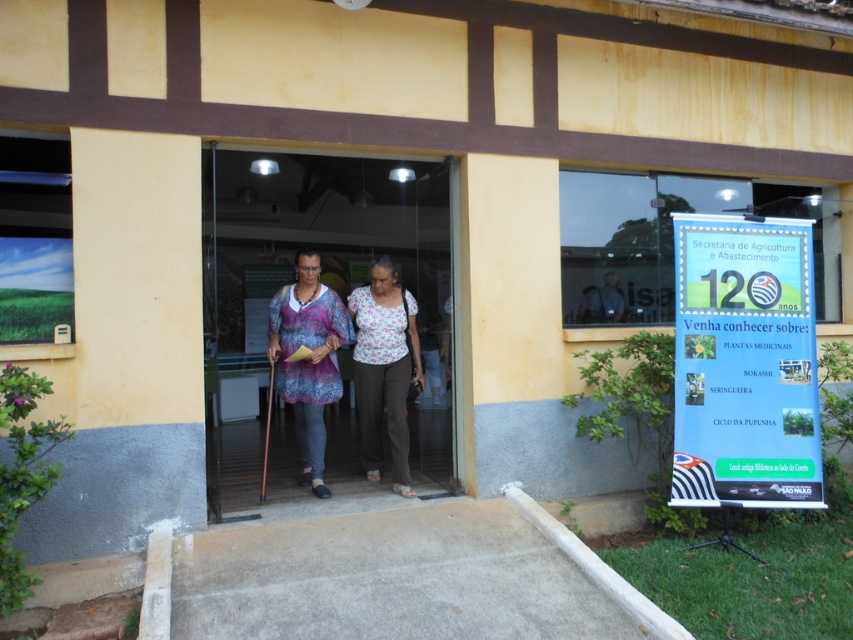
Between wooden door at center and floral fabric blouse at center, which one has more height?

With more height is floral fabric blouse at center.

Is wooden door at center taller than floral fabric blouse at center?

No, wooden door at center is not taller than floral fabric blouse at center.

The height and width of the screenshot is (640, 853). What do you see at coordinates (320, 280) in the screenshot? I see `wooden door at center` at bounding box center [320, 280].

You are a GUI agent. You are given a task and a screenshot of the screen. Output one action in this format:
    pyautogui.click(x=<x>, y=<y>)
    Task: Click on the wooden door at center
    The width and height of the screenshot is (853, 640).
    Given the screenshot: What is the action you would take?
    pyautogui.click(x=320, y=280)

Can you confirm if wooden door at center is positioned to the left of matte purple dress at center?

Yes, wooden door at center is to the left of matte purple dress at center.

Is wooden door at center below matte purple dress at center?

No.

I want to click on wooden door at center, so click(320, 280).

From the picture: Between wooden door at center and dark blue shirt at center, which one is positioned higher?

wooden door at center is higher up.

What do you see at coordinates (320, 280) in the screenshot? I see `wooden door at center` at bounding box center [320, 280].

What are the coordinates of `wooden door at center` in the screenshot? It's located at (320, 280).